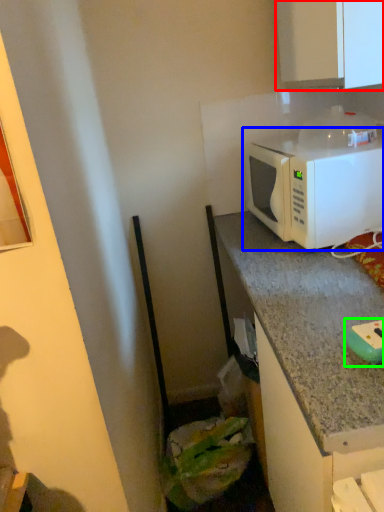
Question: Considering the real-world distances, which object is farthest from cabinetry (highlighted by a red box)? microwave oven (highlighted by a blue box) or appliance (highlighted by a green box)?

Choices:
 (A) microwave oven
 (B) appliance

Answer: (B)